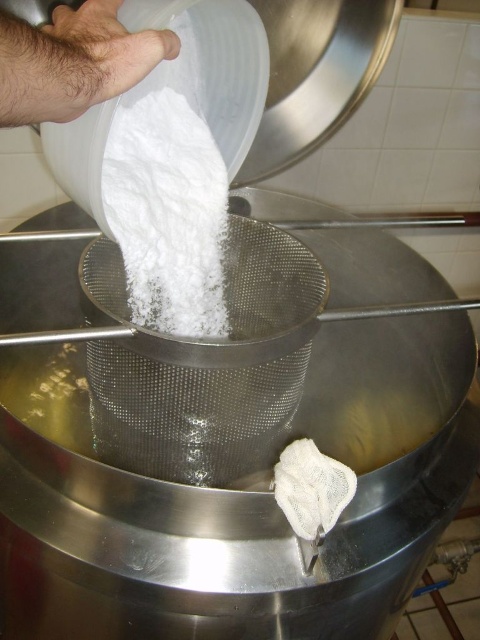
Between white powder at center and hairy skin at upper left, which one has less height?

Standing shorter between the two is hairy skin at upper left.

Is white powder at center positioned in front of hairy skin at upper left?

No, white powder at center is behind hairy skin at upper left.

You are a GUI agent. You are given a task and a screenshot of the screen. Output one action in this format:
    pyautogui.click(x=<x>, y=<y>)
    Task: Click on the white powder at center
    This screenshot has width=480, height=640.
    Given the screenshot: What is the action you would take?
    pyautogui.click(x=168, y=214)

This screenshot has width=480, height=640. Identify the location of white powder at center. (168, 214).